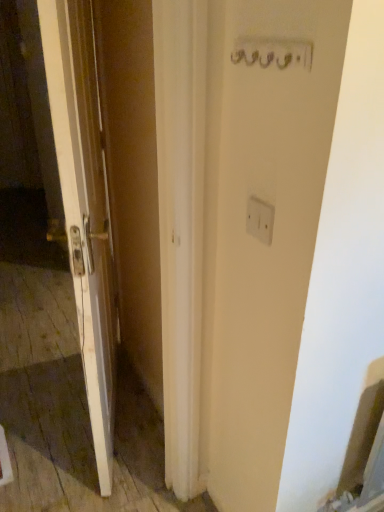
The height and width of the screenshot is (512, 384). In order to click on white plastic electric outlet at center in this screenshot , I will do `click(260, 219)`.

Describe the element at coordinates (260, 219) in the screenshot. I see `white plastic electric outlet at center` at that location.

The width and height of the screenshot is (384, 512). I want to click on white plastic electric outlet at center, so click(260, 219).